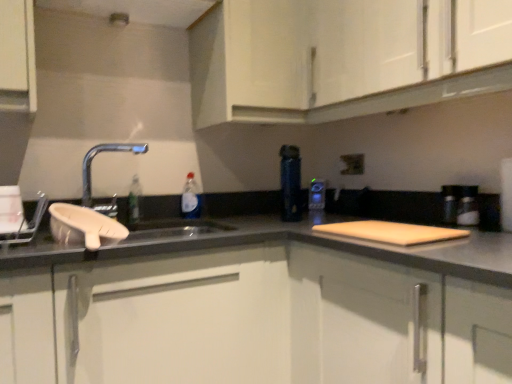
Question: In the image, is translucent plastic bottle at sink positioned in front of or behind wooden cutting board at center, arranged as the 3th cabinetry when viewed from the top?

Choices:
 (A) behind
 (B) front

Answer: (A)

Question: In the image, is translucent plastic bottle at sink on the left side or the right side of wooden cutting board at center, arranged as the 1th cabinetry when ordered from the bottom?

Choices:
 (A) left
 (B) right

Answer: (A)

Question: Which is farther from the white matte cabinet at lower center, the second cabinetry viewed from the top?

Choices:
 (A) light brown wood cutting board at right
 (B) translucent plastic bottle at sink
 (C) matte black electric outlet at upper center
 (D) blue glossy thermos at center
 (E) wooden cutting board at center, arranged as the 3th cabinetry when viewed from the top

Answer: (C)

Question: Estimate the real-world distances between objects in this image. Which object is farther from the blue glossy thermos at center?

Choices:
 (A) light brown wood cutting board at right
 (B) white matte cabinet at upper center, which is the 1th cabinetry in top-to-bottom order
 (C) matte black electric outlet at upper center
 (D) wooden cutting board at center, arranged as the 1th cabinetry when ordered from the bottom
 (E) white matte cabinet at lower center, the second cabinetry viewed from the top

Answer: (D)